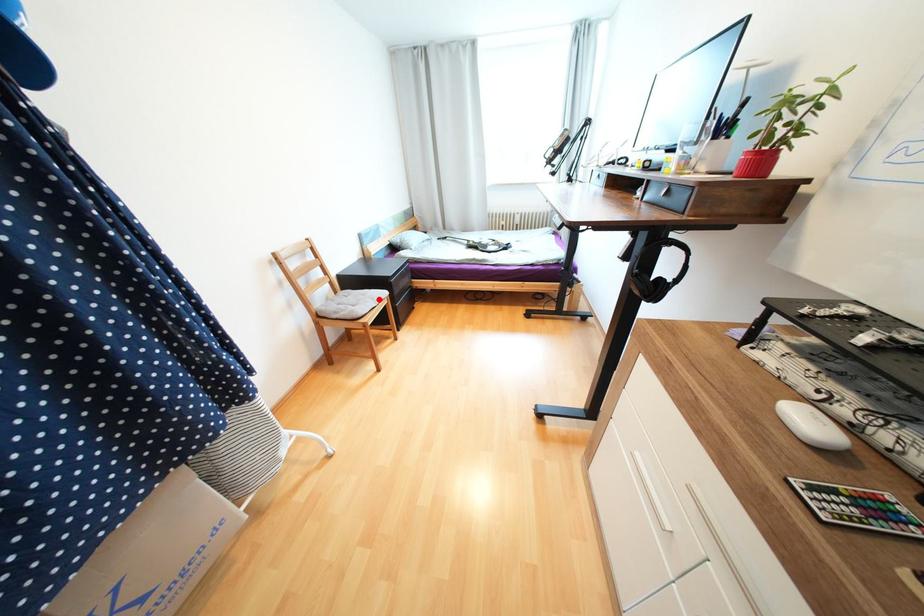
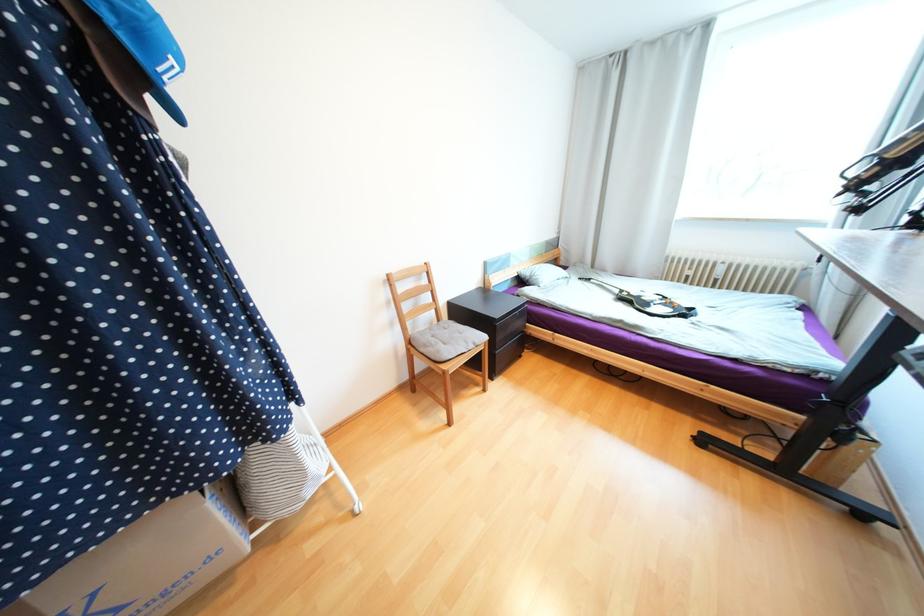
In the second image, find the point that corresponds to the highlighted location in the first image.

(472, 342)